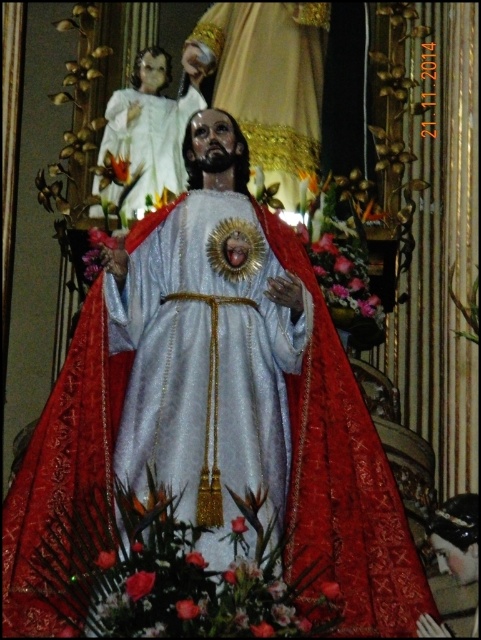
You are an art curator planning to install a new light fixture in the gallery. The shiny silver statue at center is positioned at coordinates 0.537 on the x and 0.432 on the y. If you want to place the light directly above the statue to highlight it, where should the light be placed?

The light should be placed directly above the shiny silver statue at center, so its coordinates would be approximately the same x value of 0.537 and a higher y value than 0.432 to ensure it is positioned overhead.

You are an art curator planning to display both the shiny silver statue at center and the white glossy statue at upper left in a gallery. Which statue should be placed in a more prominent location to emphasize its size?

The shiny silver statue at center should be placed in a more prominent location because it is bigger than the white glossy statue at upper left.